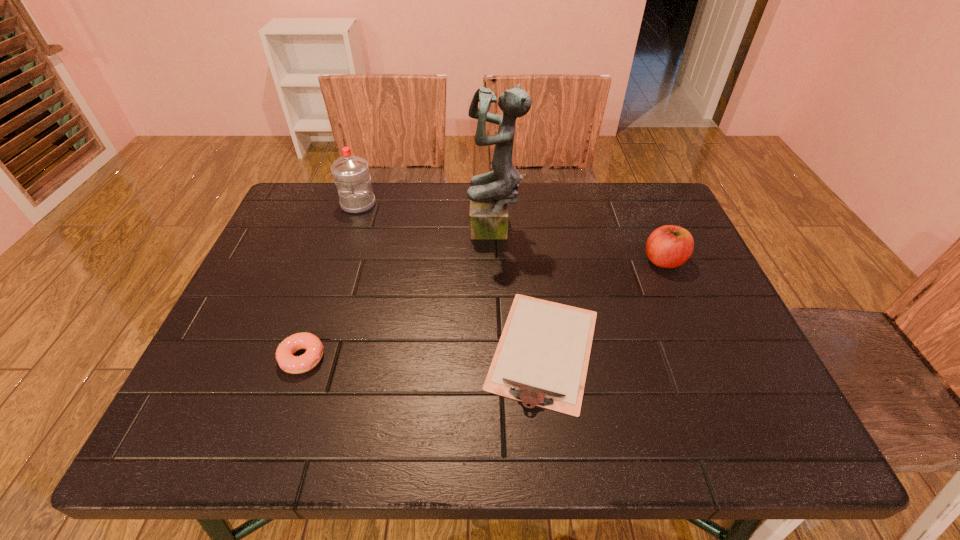
Locate an element on the screen. The height and width of the screenshot is (540, 960). object present at the far left corner is located at coordinates pos(351,174).

Find the location of a particular element. vacant position at the near edge of the desktop is located at coordinates (523, 411).

In order to click on vacant space at the left edge of the desktop in this screenshot , I will do 238,327.

In the image, there is a desktop. Find the location of `vacant space at the right edge`. vacant space at the right edge is located at coordinates (743, 404).

In the image, there is a desktop. Where is `free region at the near left corner`? The width and height of the screenshot is (960, 540). free region at the near left corner is located at coordinates (190, 415).

In the image, there is a desktop. Where is `vacant space at the far right corner`? The image size is (960, 540). vacant space at the far right corner is located at coordinates (626, 186).

This screenshot has height=540, width=960. In the image, there is a desktop. In order to click on vacant space at the near right corner in this screenshot , I will do `click(738, 444)`.

Identify the location of vacant region between the farthest object and the apple. The width and height of the screenshot is (960, 540). (511, 232).

This screenshot has height=540, width=960. What are the coordinates of `free area in between the sculpture and the doughnut` in the screenshot? It's located at (398, 294).

Identify the location of free space between the fourth tallest object and the third shortest object. The width and height of the screenshot is (960, 540). (483, 309).